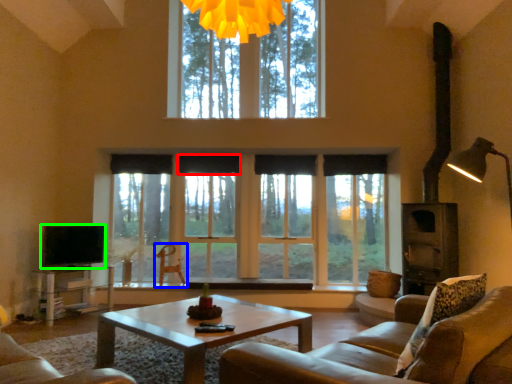
Question: Which is farther away from curtain (highlighted by a red box)? armchair (highlighted by a blue box) or level (highlighted by a green box)?

Choices:
 (A) armchair
 (B) level

Answer: (B)